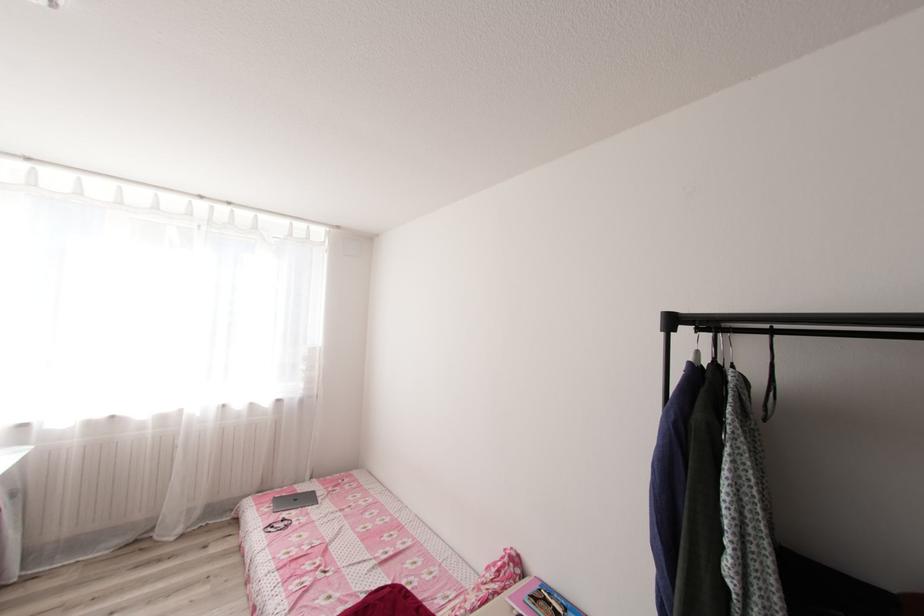
Find the location of `white clothes hanger`. white clothes hanger is located at coordinates click(x=728, y=351).